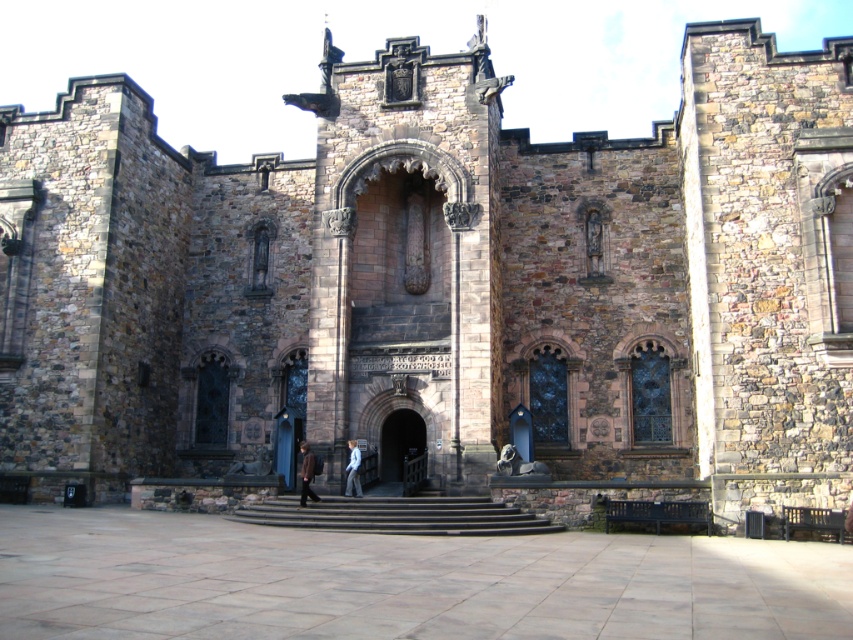
Question: Is black stone stairs at center smaller than brown leather jacket at center?

Choices:
 (A) no
 (B) yes

Answer: (A)

Question: Is brown leather jacket at center above light blue denim jacket at center?

Choices:
 (A) yes
 (B) no

Answer: (B)

Question: Is black stone stairs at center wider than dark stone archway at center?

Choices:
 (A) yes
 (B) no

Answer: (A)

Question: Which point appears closest to the camera in this image?

Choices:
 (A) (413, 448)
 (B) (350, 486)

Answer: (B)

Question: Which of these objects is positioned closest to the brown leather jacket at center?

Choices:
 (A) light blue denim jacket at center
 (B) black stone stairs at center

Answer: (A)

Question: Which of the following is the farthest from the observer?

Choices:
 (A) dark stone archway at center
 (B) light blue denim jacket at center

Answer: (A)